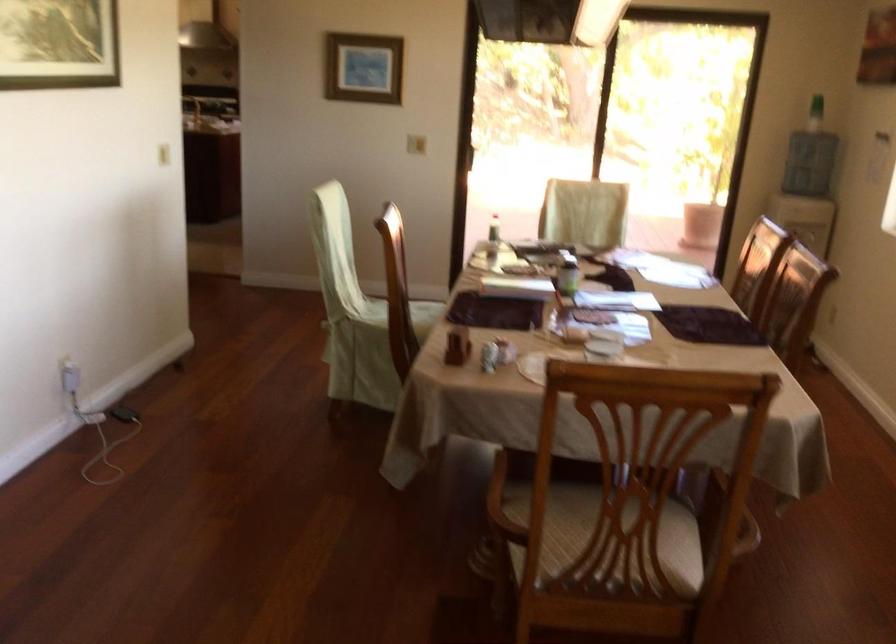
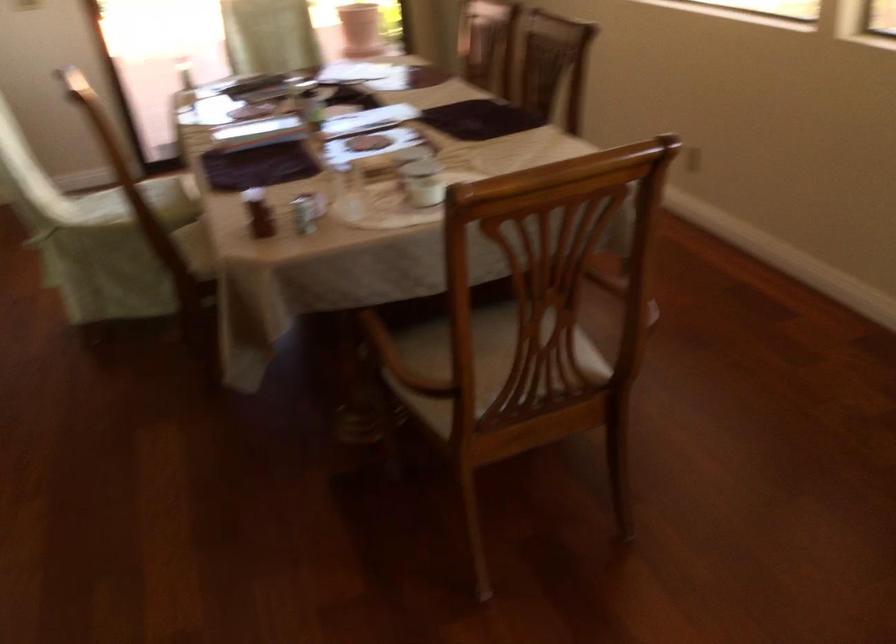
Question: The camera is either moving clockwise (left) or counter-clockwise (right) around the object. The first image is from the beginning of the video and the second image is from the end. Is the camera moving left or right when shooting the video?

Choices:
 (A) Left
 (B) Right

Answer: (A)